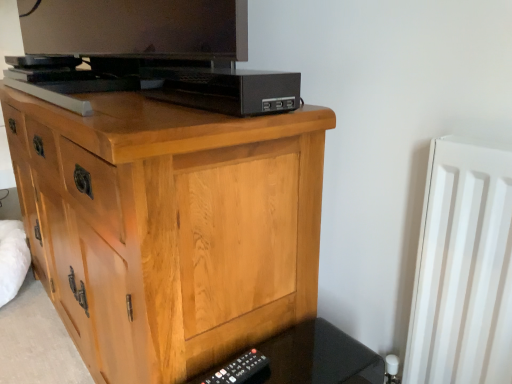
Image resolution: width=512 pixels, height=384 pixels. I want to click on black plastic usb hub at upper center, so click(227, 89).

Describe the element at coordinates (239, 369) in the screenshot. I see `black plastic remote at lower right` at that location.

Find the location of a particular element. The image size is (512, 384). black plastic remote at lower right is located at coordinates (239, 369).

What is the approximate height of black plastic remote at lower right?

The height of black plastic remote at lower right is 19.66 centimeters.

Where is `light wood chest of drawers at center`? This screenshot has width=512, height=384. light wood chest of drawers at center is located at coordinates (169, 227).

Which of these two, black plastic remote at lower right or light wood chest of drawers at center, stands shorter?

Standing shorter between the two is black plastic remote at lower right.

Is point (355, 366) positioned behind point (219, 271)?

Yes.

From a real-world perspective, who is located lower, black plastic remote at lower right or light wood chest of drawers at center?

In real-world perspective, black plastic remote at lower right is lower.

Measure the distance between black plastic remote at lower right and light wood chest of drawers at center.

black plastic remote at lower right and light wood chest of drawers at center are 11.04 inches apart from each other.

Identify the location of chest of drawers in front of the black plastic remote at lower right. The height and width of the screenshot is (384, 512). (169, 227).

Considering the sizes of black plastic remote at lower right and light wood chest of drawers at center in the image, is black plastic remote at lower right wider or thinner than light wood chest of drawers at center?

black plastic remote at lower right is thinner than light wood chest of drawers at center.

Is black plastic remote at lower right bigger or smaller than light wood chest of drawers at center?

Clearly, black plastic remote at lower right is smaller in size than light wood chest of drawers at center.

From the image's perspective, who appears lower, black plastic remote at lower right or light wood chest of drawers at center?

black plastic remote at lower right, from the image's perspective.

From the image's perspective, is black plastic usb hub at upper center over light wood chest of drawers at center?

Correct, black plastic usb hub at upper center appears higher than light wood chest of drawers at center in the image.

Does black plastic usb hub at upper center appear on the left side of light wood chest of drawers at center?

No.

Does black plastic usb hub at upper center touch light wood chest of drawers at center?

No, black plastic usb hub at upper center is not next to light wood chest of drawers at center.

This screenshot has height=384, width=512. Identify the location of computer above the black plastic remote at lower right (from the image's perspective). (227, 89).

Which is more to the right, black plastic usb hub at upper center or black plastic remote at lower right?

black plastic remote at lower right.

Would you say black plastic usb hub at upper center is inside or outside black plastic remote at lower right?

black plastic usb hub at upper center is outside black plastic remote at lower right.

In the scene shown: Is black plastic usb hub at upper center next to black plastic remote at lower right?

They are not placed beside each other.

From the image's perspective, which one is positioned higher, black plastic usb hub at upper center or black plastic remote at lower right?

From the image's view, black plastic usb hub at upper center is above.

In the scene shown: Measure the distance between black plastic usb hub at upper center and black plastic remote at lower right.

51.46 centimeters.

Does black plastic usb hub at upper center turn towards black plastic remote at lower right?

No, black plastic usb hub at upper center is not turned towards black plastic remote at lower right.

Which of these two, light wood chest of drawers at center or black plastic remote at lower right, is smaller?

black plastic remote at lower right.

From the image's perspective, does light wood chest of drawers at center appear lower than black plastic remote at lower right?

Incorrect, from the image's perspective, light wood chest of drawers at center is higher than black plastic remote at lower right.

At what (x,y) coordinates should I click in order to perform the action: click on chest of drawers located on the left of black plastic remote at lower right. Please return your answer as a coordinate pair (x, y). This screenshot has width=512, height=384. Looking at the image, I should click on (169, 227).

Considering the sizes of light wood chest of drawers at center and black plastic remote at lower right in the image, is light wood chest of drawers at center taller or shorter than black plastic remote at lower right?

light wood chest of drawers at center is taller than black plastic remote at lower right.

Which of these two, light wood chest of drawers at center or black plastic remote at lower right, is thinner?

black plastic remote at lower right.

Consider the image. Is light wood chest of drawers at center looking in the opposite direction of black plastic remote at lower right?

No, black plastic remote at lower right is not at the back of light wood chest of drawers at center.

Where is `the chest of drawers located in front of the black plastic remote at lower right`? The image size is (512, 384). the chest of drawers located in front of the black plastic remote at lower right is located at coordinates (169, 227).

Find the location of `chest of drawers above the black plastic remote at lower right (from a real-world perspective)`. chest of drawers above the black plastic remote at lower right (from a real-world perspective) is located at coordinates [169, 227].

Based on their spatial positions, is light wood chest of drawers at center or black plastic usb hub at upper center closer to black plastic remote at lower right?

Among the two, light wood chest of drawers at center is located nearer to black plastic remote at lower right.

From the picture: When comparing their distances from black plastic remote at lower right, does black plastic remote at lower right or light wood chest of drawers at center seem further?

light wood chest of drawers at center.

Estimate the real-world distances between objects in this image. Which object is further from black plastic remote at lower right, black plastic remote at lower right or black plastic usb hub at upper center?

black plastic usb hub at upper center.

When comparing their distances from black plastic remote at lower right, does light wood chest of drawers at center or black plastic usb hub at upper center seem further?

The object further to black plastic remote at lower right is black plastic usb hub at upper center.

Considering their positions, is light wood chest of drawers at center positioned further to black plastic remote at lower right than black plastic remote at lower right?

light wood chest of drawers at center is positioned further to the anchor black plastic remote at lower right.

Which object lies further to the anchor point black plastic remote at lower right, black plastic usb hub at upper center or black plastic remote at lower right?

Based on the image, black plastic usb hub at upper center appears to be further to black plastic remote at lower right.

From the image, which object appears to be nearer to black plastic remote at lower right, black plastic remote at lower right or black plastic usb hub at upper center?

black plastic remote at lower right is closer to black plastic remote at lower right.

Which object lies further to the anchor point black plastic usb hub at upper center, black plastic remote at lower right or black plastic remote at lower right?

black plastic remote at lower right is positioned further to the anchor black plastic usb hub at upper center.

Identify the location of remote between black plastic usb hub at upper center and black plastic remote at lower right in the vertical direction. This screenshot has height=384, width=512. (239, 369).

At what (x,y) coordinates should I click in order to perform the action: click on the chest of drawers between black plastic usb hub at upper center and black plastic remote at lower right vertically. Please return your answer as a coordinate pair (x, y). Looking at the image, I should click on (169, 227).

Locate an element on the screen. This screenshot has width=512, height=384. remote located between light wood chest of drawers at center and black plastic remote at lower right in the left-right direction is located at coordinates (239, 369).

This screenshot has width=512, height=384. Identify the location of chest of drawers between black plastic usb hub at upper center and black plastic remote at lower right in the up-down direction. (169, 227).